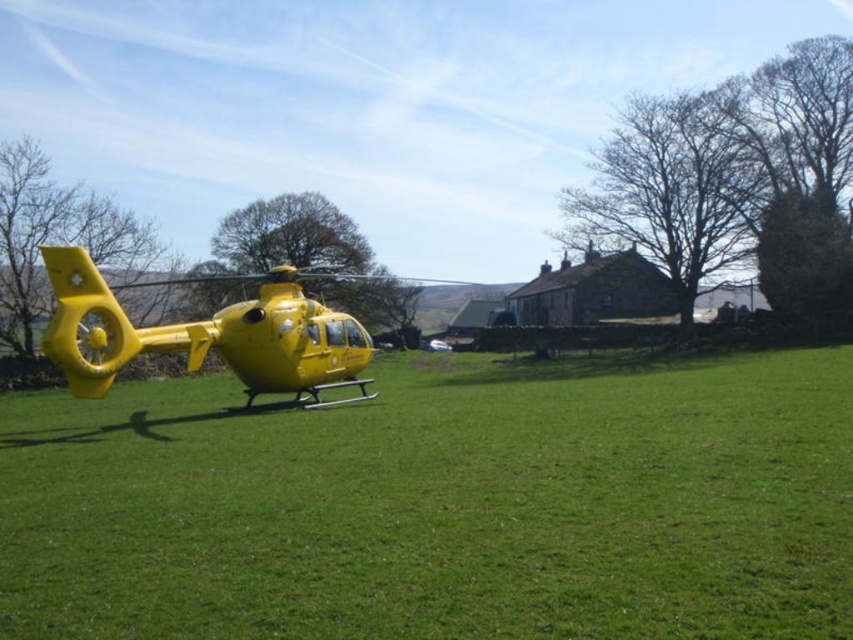
You are a photographer trying to capture both the yellow matte helicopter at left and the yellow matte helicopter at center in a single shot. Based on their heights, which helicopter should you position closer to the camera to ensure both appear roughly the same size in the photo?

The yellow matte helicopter at left is not as tall as the yellow matte helicopter at center. To make them appear similar in size, position the shorter yellow matte helicopter at left closer to the camera and the taller yellow matte helicopter at center farther away.

You are a drone operator trying to capture aerial footage of the yellow matte helicopter at center. You notice another yellow matte helicopter at left in the shot. Which helicopter is closer to the ground?

The yellow matte helicopter at left is positioned under the yellow matte helicopter at center, so it is closer to the ground.